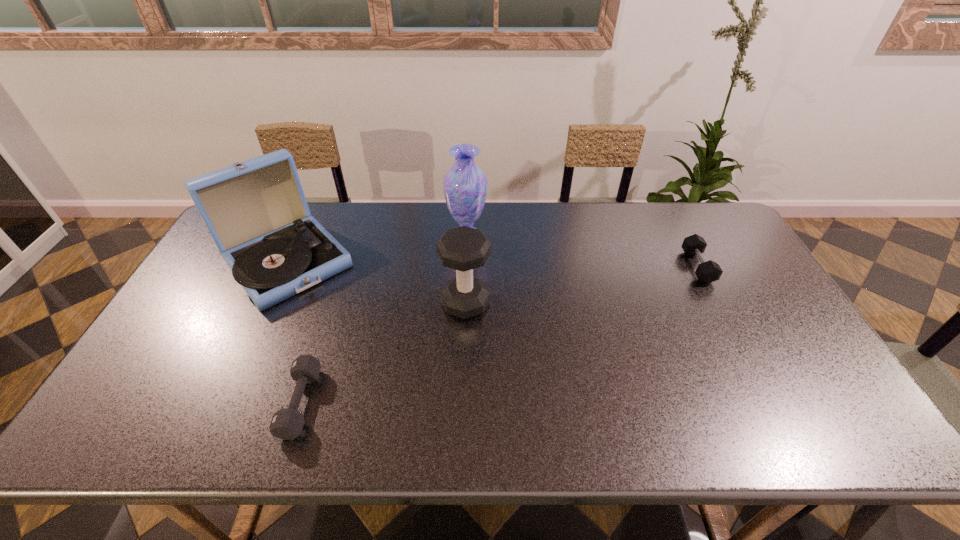
What are the coordinates of `free space between the second dumbbell from left to right and the nearest dumbbell` in the screenshot? It's located at (383, 353).

Find the location of a particular element. The image size is (960, 540). vacant point located between the nearest object and the rightmost object is located at coordinates (499, 335).

In order to click on object that stands as the third closest to the vase in this screenshot , I will do `click(287, 423)`.

Identify which object is the closest to the farthest dumbbell. Please provide its 2D coordinates. Your answer should be formatted as a tuple, i.e. [(x, y)], where the tuple contains the x and y coordinates of a point satisfying the conditions above.

[(463, 248)]

Where is `the closest dumbbell to the farthest dumbbell`? the closest dumbbell to the farthest dumbbell is located at coordinates (463, 248).

You are a GUI agent. You are given a task and a screenshot of the screen. Output one action in this format:
    pyautogui.click(x=<x>, y=<y>)
    Task: Click on the closest dumbbell relative to the phonograph record
    This screenshot has width=960, height=540.
    Given the screenshot: What is the action you would take?
    pyautogui.click(x=287, y=423)

Identify the location of free region that satisfies the following two spatial constraints: 1. on the front side of the phonograph record; 2. on the left side of the nearest object. This screenshot has height=540, width=960. (221, 402).

Locate an element on the screen. free space in the image that satisfies the following two spatial constraints: 1. on the back side of the rightmost dumbbell; 2. on the left side of the second dumbbell from right to left is located at coordinates (x=467, y=267).